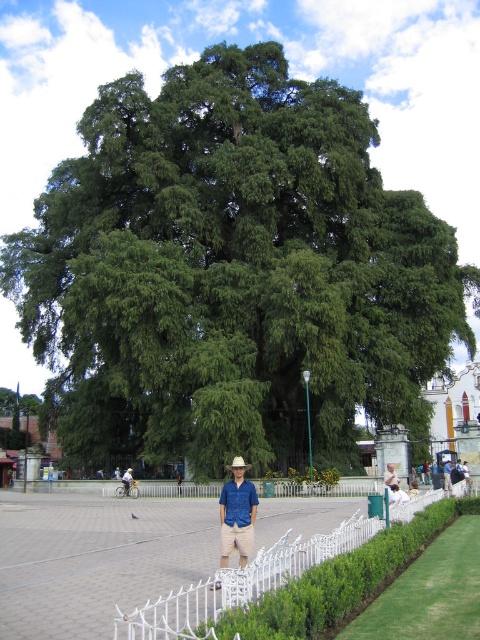
Which is in front, point (61, 266) or point (233, 472)?

Point (233, 472)

Who is shorter, green leafy tree at center or blue cotton shirt at center?

With less height is blue cotton shirt at center.

Where is `green leafy tree at center`? This screenshot has height=640, width=480. green leafy tree at center is located at coordinates (231, 272).

Does white wrought iron fence at lower right have a greater width compared to blue cotton shirt at center?

Correct, the width of white wrought iron fence at lower right exceeds that of blue cotton shirt at center.

Which of these two, white wrought iron fence at lower right or blue cotton shirt at center, stands shorter?

With less height is white wrought iron fence at lower right.

Who is more forward, [140,612] or [241,547]?

Point [140,612] is in front.

The image size is (480, 640). Find the location of `white wrought iron fence at lower right`. white wrought iron fence at lower right is located at coordinates (240, 584).

Between point (151, 608) and point (131, 481), which one is positioned behind?

Point (131, 481)

Which is above, white wrought iron fence at lower right or blue denim shirt at center?

white wrought iron fence at lower right is higher up.

In order to click on white wrought iron fence at lower right in this screenshot , I will do `click(240, 584)`.

At what (x,y) coordinates should I click in order to perform the action: click on white wrought iron fence at lower right. Please return your answer as a coordinate pair (x, y). This screenshot has height=640, width=480. Looking at the image, I should click on (240, 584).